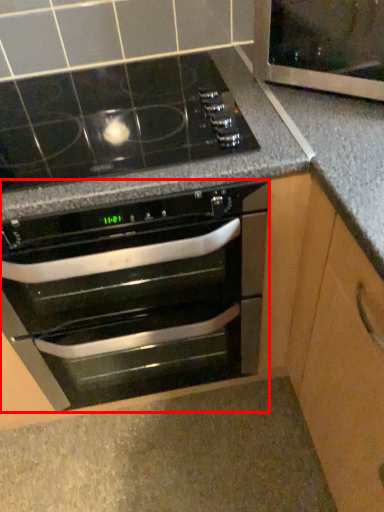
Question: From the image's perspective, what is the correct spatial relationship of oven (annotated by the red box) in relation to glass door?

Choices:
 (A) below
 (B) above

Answer: (A)